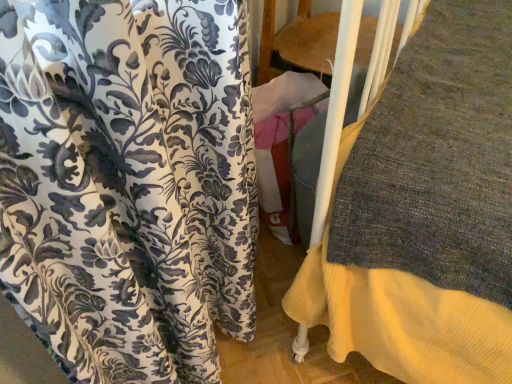
Question: Is floral fabric curtain at left positioned with its back to wooden bunk bed at center?

Choices:
 (A) yes
 (B) no

Answer: (B)

Question: From the image's perspective, would you say floral fabric curtain at left is shown under wooden bunk bed at center?

Choices:
 (A) no
 (B) yes

Answer: (B)

Question: Is floral fabric curtain at left thinner than wooden bunk bed at center?

Choices:
 (A) no
 (B) yes

Answer: (A)

Question: Considering the relative sizes of floral fabric curtain at left and wooden bunk bed at center in the image provided, is floral fabric curtain at left shorter than wooden bunk bed at center?

Choices:
 (A) yes
 (B) no

Answer: (A)

Question: Is floral fabric curtain at left to the left of wooden bunk bed at center from the viewer's perspective?

Choices:
 (A) no
 (B) yes

Answer: (B)

Question: Is floral fabric curtain at left further to camera compared to wooden bunk bed at center?

Choices:
 (A) no
 (B) yes

Answer: (A)

Question: From the image's perspective, does wooden bunk bed at center appear higher than floral fabric curtain at left?

Choices:
 (A) yes
 (B) no

Answer: (A)

Question: Does wooden bunk bed at center have a lesser height compared to floral fabric curtain at left?

Choices:
 (A) no
 (B) yes

Answer: (A)

Question: Considering the relative positions of wooden bunk bed at center and floral fabric curtain at left in the image provided, is wooden bunk bed at center to the left of floral fabric curtain at left from the viewer's perspective?

Choices:
 (A) no
 (B) yes

Answer: (A)

Question: Is wooden bunk bed at center looking in the opposite direction of floral fabric curtain at left?

Choices:
 (A) no
 (B) yes

Answer: (A)

Question: Is the position of wooden bunk bed at center less distant than that of floral fabric curtain at left?

Choices:
 (A) no
 (B) yes

Answer: (A)

Question: From a real-world perspective, is wooden bunk bed at center below floral fabric curtain at left?

Choices:
 (A) yes
 (B) no

Answer: (A)

Question: From a real-world perspective, relative to wooden bunk bed at center, is floral fabric curtain at left vertically above or below?

Choices:
 (A) above
 (B) below

Answer: (A)